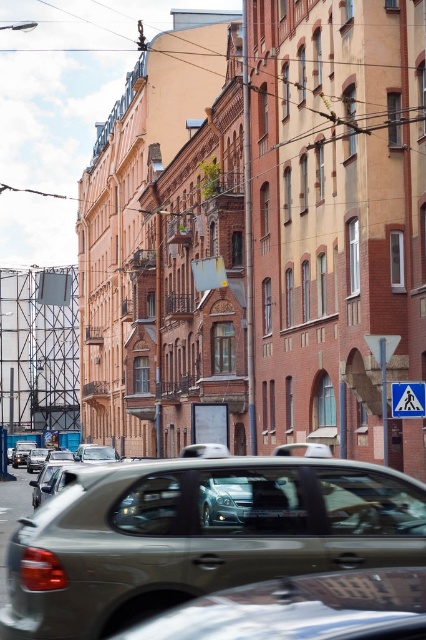
You are a pedestrian waiting at the crosswalk. You see a metallic silver car at center and a blue plastic pedestrian crossing sign at center. Which object is taller?

The metallic silver car at center is taller than the blue plastic pedestrian crossing sign at center.

You are standing at the point labeled as point (x=199, y=534) in the image. What object are you currently standing on?

You are standing on the metallic silver car at center.